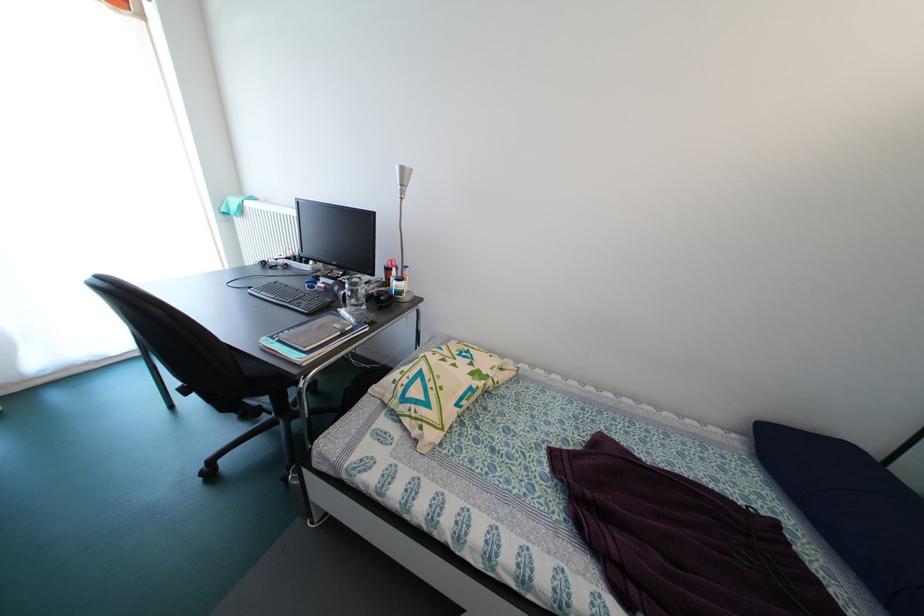
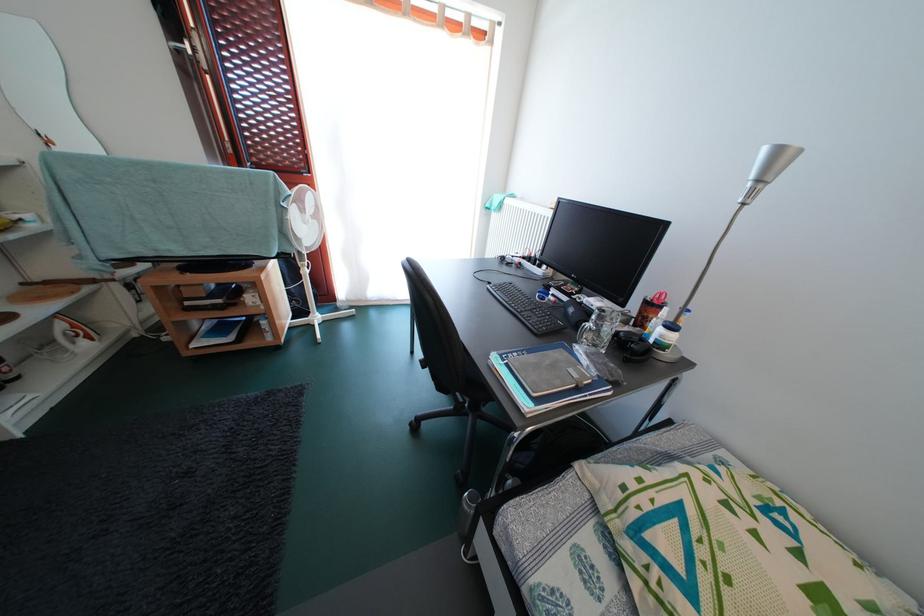
In the second image, find the point that corresponds to (409,175) in the first image.

(785, 156)